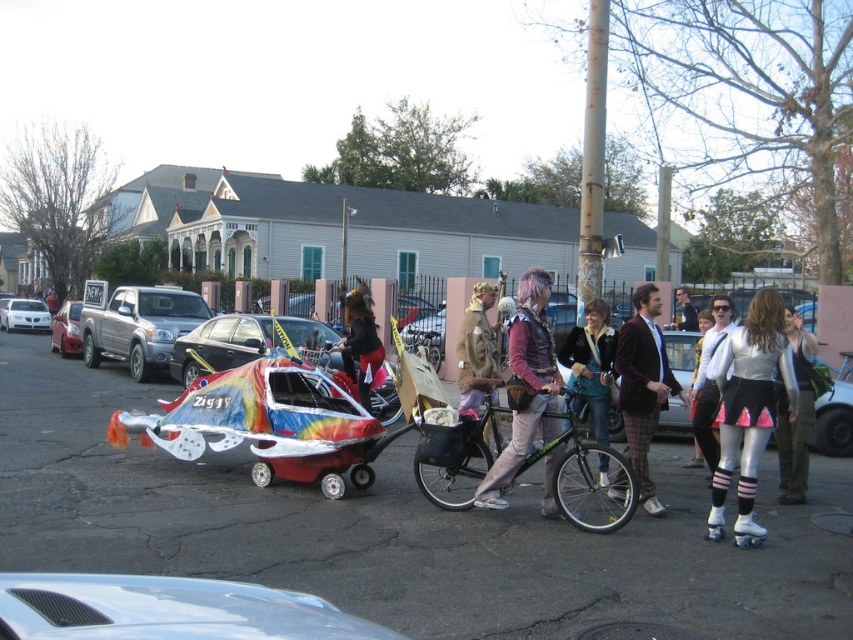
Question: Considering the real-world distances, which object is closest to the shiny silver car at center?

Choices:
 (A) shiny metallic helmet at center
 (B) white matte car at left
 (C) maroon wool suit at center

Answer: (C)

Question: Which point is closer to the camera?

Choices:
 (A) (308, 564)
 (B) (538, 336)
 (C) (701, 461)

Answer: (A)

Question: Is silver metallic roller skates at right to the right of denim jacket at center from the viewer's perspective?

Choices:
 (A) yes
 (B) no

Answer: (A)

Question: Can you confirm if shiny metallic baby carriage at center is positioned above denim jacket at center?

Choices:
 (A) yes
 (B) no

Answer: (B)

Question: Is silver metallic pants at center right smaller than shiny metallic helmet at center?

Choices:
 (A) no
 (B) yes

Answer: (B)

Question: Estimate the real-world distances between objects in this image. Which object is farther from the shiny metallic baby carriage at center?

Choices:
 (A) denim jacket at center
 (B) silver metallic pickup truck at left
 (C) shiny metallic helmet at center
 (D) metallic silver car at center

Answer: (B)